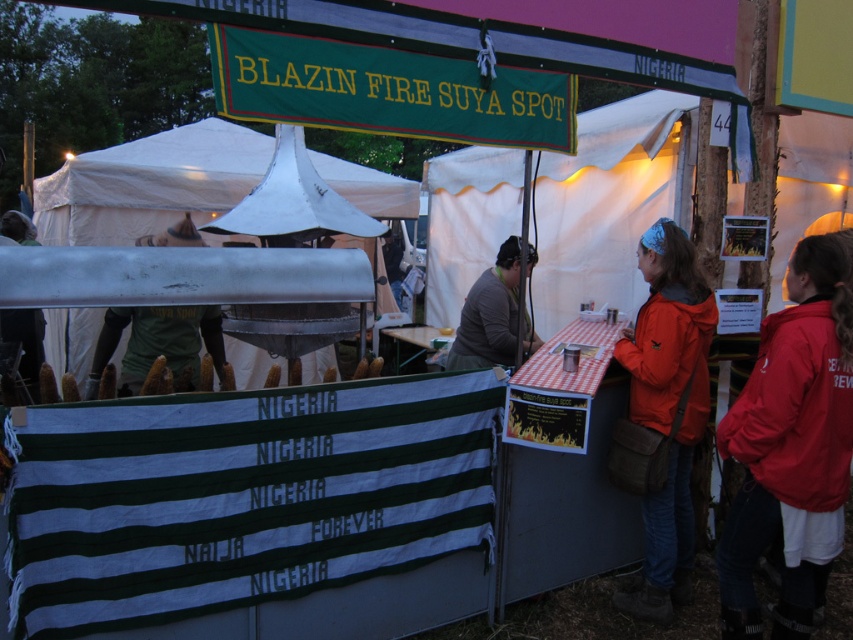
Question: Which object is farther from the camera taking this photo?

Choices:
 (A) yellow corn at center
 (B) matte green corn at center

Answer: (B)

Question: Estimate the real-world distances between objects in this image. Which object is closer to the red nylon jacket at right?

Choices:
 (A) metallic silver grill at left
 (B) yellow corn at center
 (C) white canvas tent at center

Answer: (B)

Question: Can you confirm if orange nylon jacket at center right is positioned to the left of matte green corn at center?

Choices:
 (A) no
 (B) yes

Answer: (A)

Question: Estimate the real-world distances between objects in this image. Which object is farther from the gray fabric at center?

Choices:
 (A) yellow corn at center
 (B) metallic tent at center

Answer: (B)

Question: Considering the relative positions of red nylon jacket at right and yellow corn at center in the image provided, where is red nylon jacket at right located with respect to yellow corn at center?

Choices:
 (A) below
 (B) above

Answer: (A)

Question: Is the position of orange nylon jacket at center right less distant than that of matte green corn at center?

Choices:
 (A) no
 (B) yes

Answer: (B)